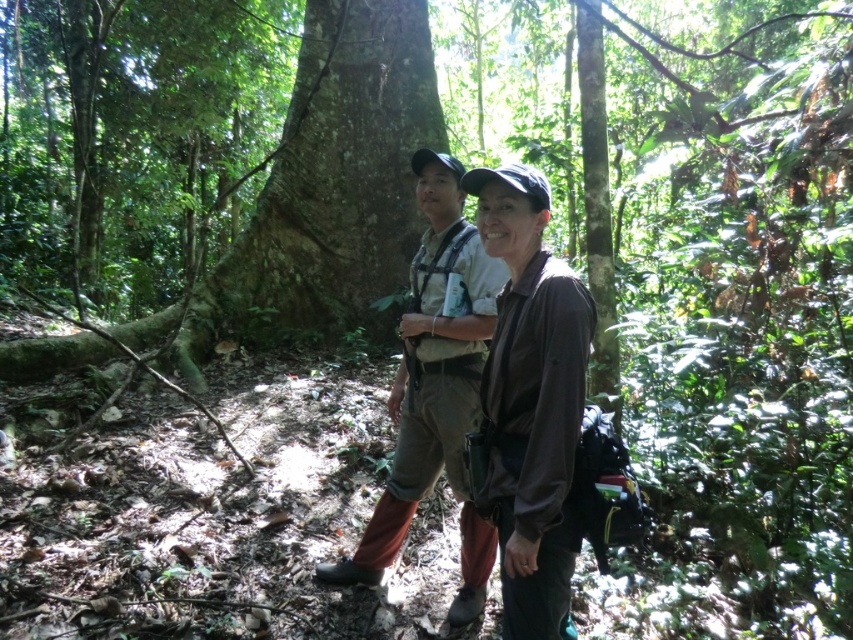
Question: Which object appears closest to the camera in this image?

Choices:
 (A) brown fabric jacket at center
 (B) brown matte shirt at center

Answer: (B)

Question: Is green rough bark tree at center behind brown matte shirt at center?

Choices:
 (A) no
 (B) yes

Answer: (B)

Question: Estimate the real-world distances between objects in this image. Which object is closer to the green rough bark tree at center?

Choices:
 (A) brown matte shirt at center
 (B) brown fabric jacket at center

Answer: (B)

Question: Among these points, which one is nearest to the camera?

Choices:
 (A) (518, 611)
 (B) (474, 179)

Answer: (A)

Question: Does green rough bark tree at center appear under brown fabric jacket at center?

Choices:
 (A) yes
 (B) no

Answer: (B)

Question: Where is green rough bark tree at center located in relation to brown fabric jacket at center in the image?

Choices:
 (A) right
 (B) left

Answer: (B)